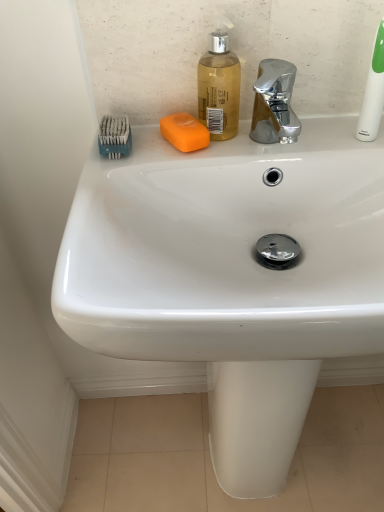
The width and height of the screenshot is (384, 512). I want to click on free space to the left of white plastic toothbrush at upper right, so click(297, 142).